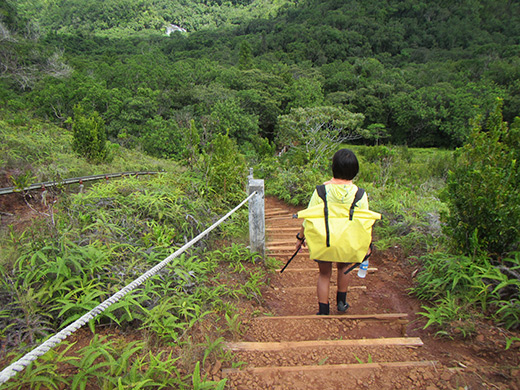
Find the location of a particular element. water bottle with blue label is located at coordinates (361, 268).